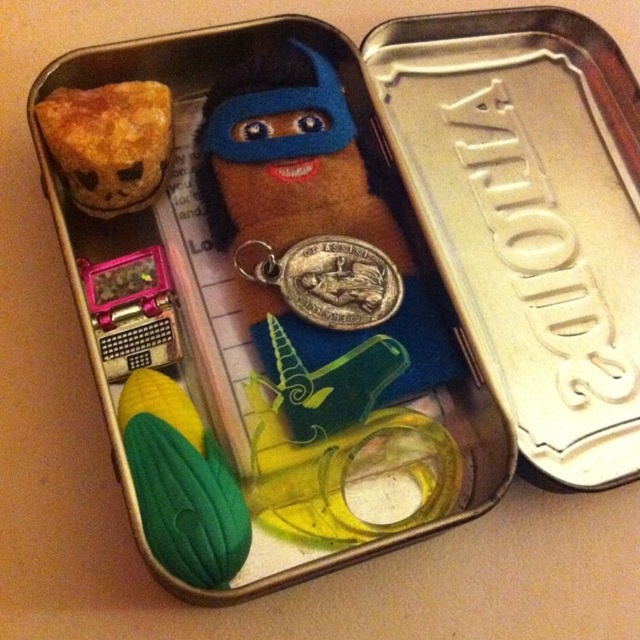
You are holding an open Altoids tin and want to place a new item in the exact same 2D position as the green rubber corn at lower left. What are the coordinates where you should place the new item?

The coordinates for the green rubber corn at lower left are at point (180, 483), so you should place the new item at those coordinates.